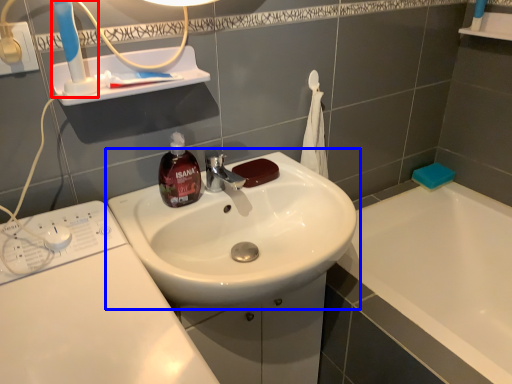
Question: Which object is closer to the camera taking this photo, toothbrush (highlighted by a red box) or sink (highlighted by a blue box)?

Choices:
 (A) toothbrush
 (B) sink

Answer: (A)